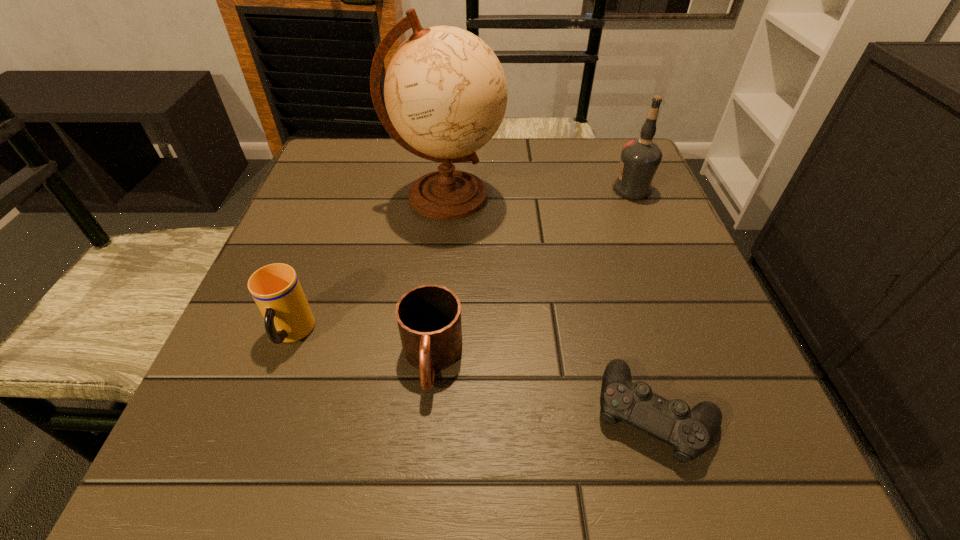
Locate an element on the screen. empty space that is in between the globe and the fourth tallest object is located at coordinates (439, 278).

Where is `blank region between the mug and the third tallest object`? The height and width of the screenshot is (540, 960). blank region between the mug and the third tallest object is located at coordinates (362, 347).

The height and width of the screenshot is (540, 960). In order to click on empty location between the fourth shortest object and the mug in this screenshot , I will do `click(532, 275)`.

Image resolution: width=960 pixels, height=540 pixels. In order to click on vacant area that lies between the shortest object and the globe in this screenshot , I will do `click(550, 305)`.

Where is `free point between the control and the globe`? free point between the control and the globe is located at coordinates (550, 305).

The height and width of the screenshot is (540, 960). Identify the location of vacant space in between the second tallest object and the cup. (462, 262).

Where is `the fourth closest object to the fourth tallest object`? The image size is (960, 540). the fourth closest object to the fourth tallest object is located at coordinates (640, 158).

Select which object is the second closest to the control. Please provide its 2D coordinates. Your answer should be formatted as a tuple, i.e. [(x, y)], where the tuple contains the x and y coordinates of a point satisfying the conditions above.

[(445, 91)]

You are a GUI agent. You are given a task and a screenshot of the screen. Output one action in this format:
    pyautogui.click(x=<x>, y=<y>)
    Task: Click on the free location that satisfies the following two spatial constraints: 1. on the side of the shortest object with the handle; 2. on the left side of the fourth tallest object
    This screenshot has width=960, height=540.
    Given the screenshot: What is the action you would take?
    pyautogui.click(x=427, y=414)

Find the location of a particular element. This screenshot has width=960, height=540. free spot that satisfies the following two spatial constraints: 1. on the surface of the tallest object; 2. on the back side of the shortest object is located at coordinates (426, 414).